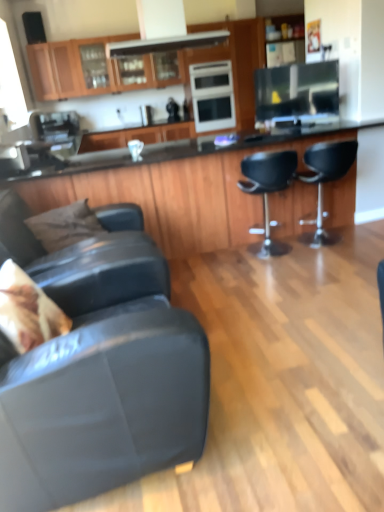
Question: From a real-world perspective, relative to leather couch at lower left, acting as the fourth chair starting from the right, is brown fabric pillow at left, positioned as the 2th pillow in bottom-to-top order, vertically above or below?

Choices:
 (A) below
 (B) above

Answer: (B)

Question: Visually, is brown fabric pillow at left, acting as the second pillow starting from the front, positioned to the left or to the right of leather couch at lower left, positioned as the first chair in left-to-right order?

Choices:
 (A) right
 (B) left

Answer: (B)

Question: Estimate the real-world distances between objects in this image. Which object is farther from the matte black couch at lower left, the second chair from the left?

Choices:
 (A) black leather bar stool at right, acting as the 1th chair starting from the right
 (B) fluffy beige pillow at lower left, which is counted as the second pillow, starting from the top
 (C) black glossy countertop at center
 (D) brown fabric pillow at left, which is counted as the first pillow, starting from the back
 (E) matte black television at upper center, the first appliance when ordered from right to left

Answer: (E)

Question: Which object is the closest to the brown fabric pillow at left, which is counted as the first pillow, starting from the back?

Choices:
 (A) black glossy countertop at center
 (B) sleek stainless steel oven at center, the 1th appliance when ordered from left to right
 (C) matte black couch at lower left, acting as the third chair starting from the right
 (D) black leather bar stool at center, marked as the 3th chair in a left-to-right arrangement
 (E) black leather bar stool at right, arranged as the 4th chair when viewed from the left

Answer: (C)